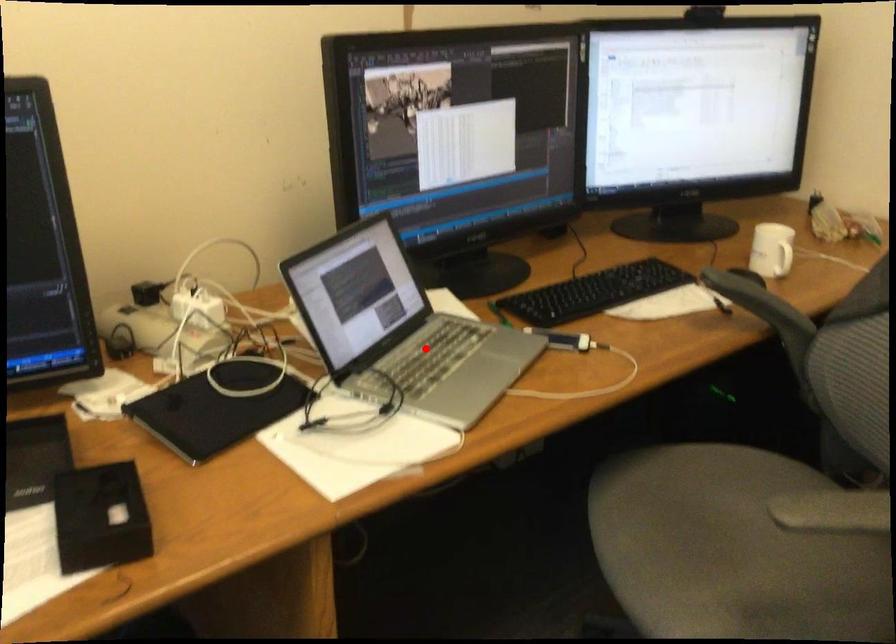
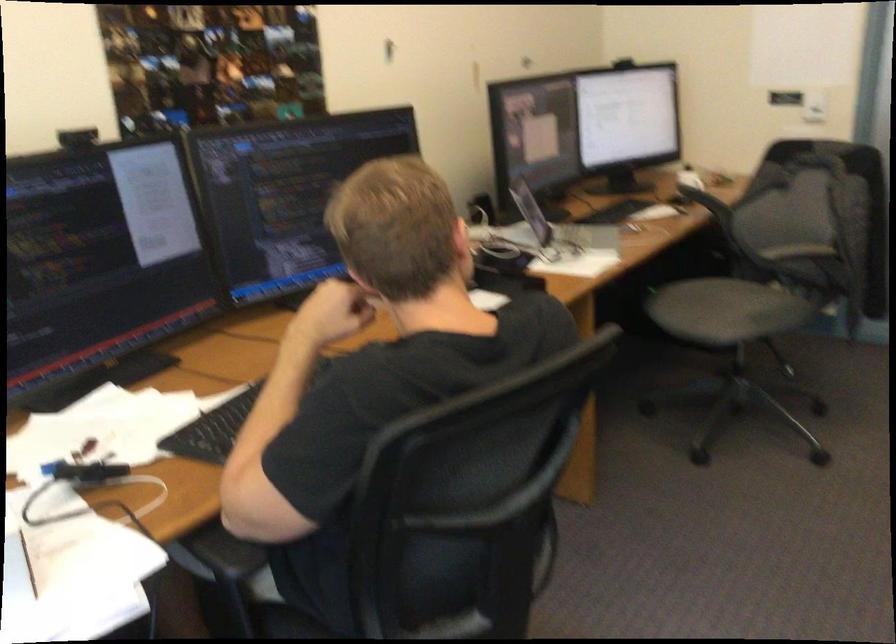
Locate, in the second image, the point that corresponds to the highlighted location in the first image.

(561, 230)